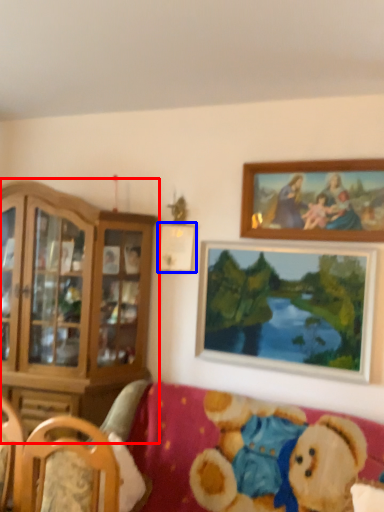
Question: Which object is closer to the camera taking this photo, cabinetry (highlighted by a red box) or picture frame (highlighted by a blue box)?

Choices:
 (A) cabinetry
 (B) picture frame

Answer: (A)